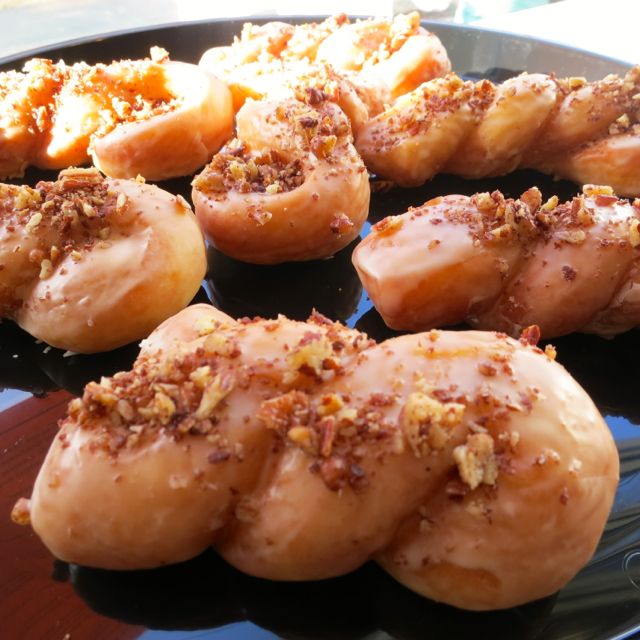
Identify the location of rim of plate. (193, 28), (500, 38).